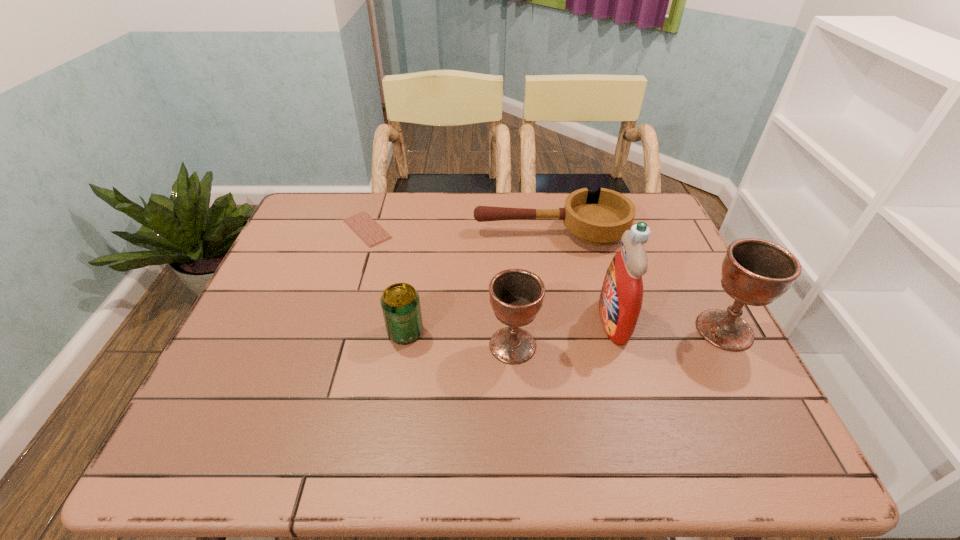
Considering the uniform spacing of chalices, where should an additional chalice be positioned on the left? Please locate a free spot. Please provide its 2D coordinates. Your answer should be formatted as a tuple, i.e. [(x, y)], where the tuple contains the x and y coordinates of a point satisfying the conditions above.

[(286, 362)]